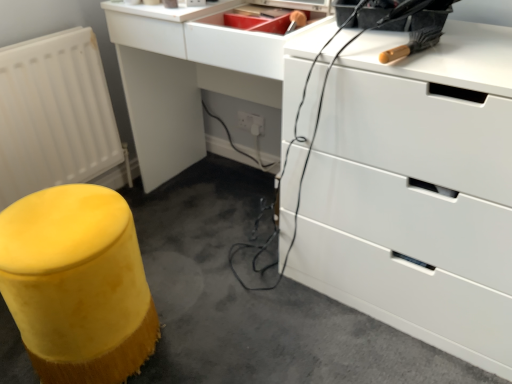
Question: Can you confirm if white matte radiator at lower left is shorter than yellow fuzzy stool at lower left?

Choices:
 (A) yes
 (B) no

Answer: (B)

Question: Does white matte radiator at lower left have a smaller size compared to yellow fuzzy stool at lower left?

Choices:
 (A) no
 (B) yes

Answer: (A)

Question: Are white matte radiator at lower left and yellow fuzzy stool at lower left located far from each other?

Choices:
 (A) yes
 (B) no

Answer: (B)

Question: Does white matte radiator at lower left appear on the left side of yellow fuzzy stool at lower left?

Choices:
 (A) yes
 (B) no

Answer: (A)

Question: From a real-world perspective, is white matte radiator at lower left physically above yellow fuzzy stool at lower left?

Choices:
 (A) yes
 (B) no

Answer: (A)

Question: Visually, is yellow fuzzy stool at lower left positioned to the left or to the right of white glossy chest of drawers at upper right?

Choices:
 (A) right
 (B) left

Answer: (B)

Question: Would you say yellow fuzzy stool at lower left is inside or outside white glossy chest of drawers at upper right?

Choices:
 (A) outside
 (B) inside

Answer: (A)

Question: From the image's perspective, is yellow fuzzy stool at lower left located above or below white glossy chest of drawers at upper right?

Choices:
 (A) below
 (B) above

Answer: (A)

Question: Considering the positions of yellow fuzzy stool at lower left and white glossy chest of drawers at upper right in the image, is yellow fuzzy stool at lower left taller or shorter than white glossy chest of drawers at upper right?

Choices:
 (A) tall
 (B) short

Answer: (B)

Question: Considering their positions, is yellow fuzzy stool at lower left located in front of or behind white matte radiator at lower left?

Choices:
 (A) front
 (B) behind

Answer: (A)

Question: Is point (115, 218) positioned closer to the camera than point (75, 102)?

Choices:
 (A) closer
 (B) farther

Answer: (A)

Question: Is yellow fuzzy stool at lower left situated inside white matte radiator at lower left or outside?

Choices:
 (A) inside
 (B) outside

Answer: (B)

Question: Considering the positions of yellow fuzzy stool at lower left and white matte radiator at lower left in the image, is yellow fuzzy stool at lower left wider or thinner than white matte radiator at lower left?

Choices:
 (A) thin
 (B) wide

Answer: (B)

Question: From a real-world perspective, is yellow fabric stool at lower left physically located above or below white matte radiator at lower left?

Choices:
 (A) above
 (B) below

Answer: (B)

Question: Is yellow fabric stool at lower left wider or thinner than white matte radiator at lower left?

Choices:
 (A) thin
 (B) wide

Answer: (B)